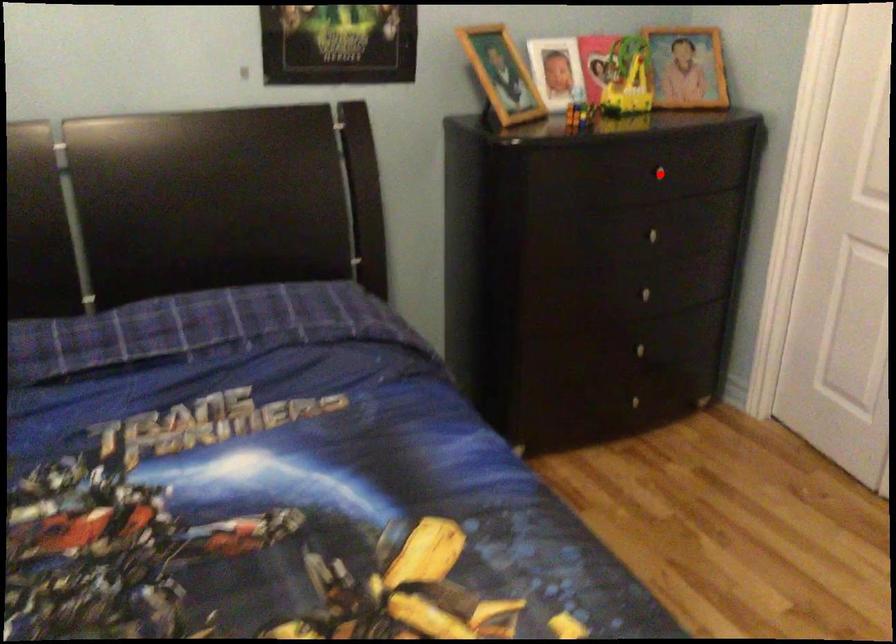
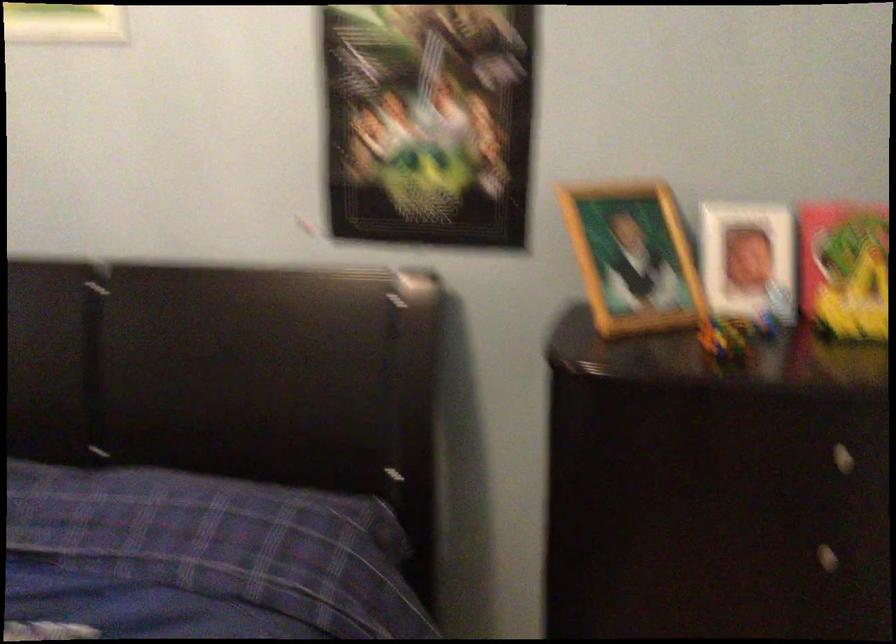
Question: I am providing you with two images of the same scene from different viewpoints. Image1 has a red point marked. In image2, the corresponding 3D location appears at what relative position? Reply with the corresponding letter.

Choices:
 (A) Closer
 (B) Farther

Answer: (A)